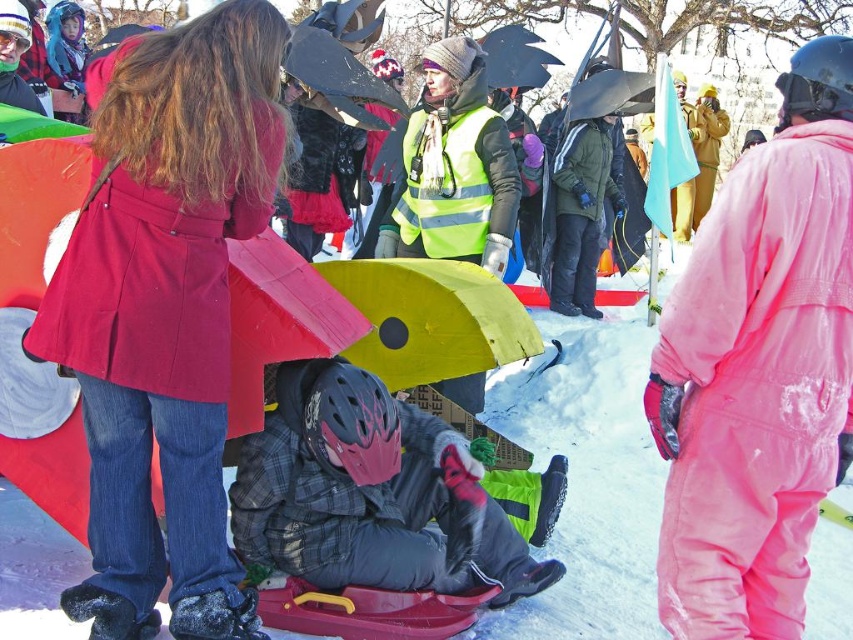
Question: Which of the following is the closest to the observer?

Choices:
 (A) pink snowsuit at right
 (B) white fluffy snow at center
 (C) plaid fabric snowboard at center

Answer: (A)

Question: Estimate the real-world distances between objects in this image. Which object is closer to the pink snowsuit at right?

Choices:
 (A) plaid fabric snowboard at center
 (B) white fluffy snow at center

Answer: (A)

Question: Is pink snowsuit at right below plaid fabric snowboard at center?

Choices:
 (A) no
 (B) yes

Answer: (A)

Question: Can you confirm if pink snowsuit at right is positioned above plaid fabric snowboard at center?

Choices:
 (A) no
 (B) yes

Answer: (B)

Question: Which of the following is the farthest from the observer?

Choices:
 (A) (401, 588)
 (B) (602, 614)

Answer: (B)

Question: Does white fluffy snow at center have a greater width compared to plaid fabric snowboard at center?

Choices:
 (A) yes
 (B) no

Answer: (B)